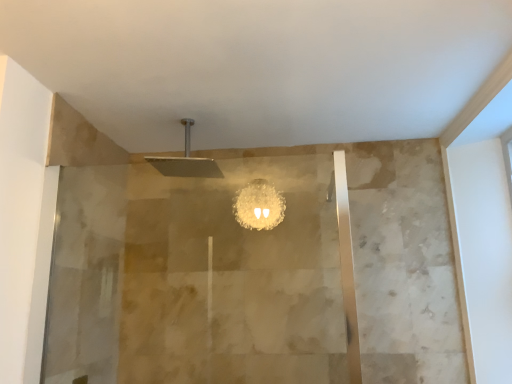
Question: Should I look upward or downward to see translucent glass screen door at left?

Choices:
 (A) down
 (B) up

Answer: (A)

Question: Can you confirm if translucent glass screen door at left is smaller than matte silver shower head at upper center?

Choices:
 (A) no
 (B) yes

Answer: (A)

Question: Is translucent glass screen door at left closer to camera compared to matte silver shower head at upper center?

Choices:
 (A) no
 (B) yes

Answer: (B)

Question: Is translucent glass screen door at left directly adjacent to matte silver shower head at upper center?

Choices:
 (A) no
 (B) yes

Answer: (A)

Question: Does translucent glass screen door at left turn towards matte silver shower head at upper center?

Choices:
 (A) no
 (B) yes

Answer: (B)

Question: Is translucent glass screen door at left behind matte silver shower head at upper center?

Choices:
 (A) no
 (B) yes

Answer: (A)

Question: From the image's perspective, does translucent glass screen door at left appear lower than matte silver shower head at upper center?

Choices:
 (A) yes
 (B) no

Answer: (A)

Question: Considering the relative sizes of matte silver shower head at upper center and translucent glass screen door at left in the image provided, is matte silver shower head at upper center shorter than translucent glass screen door at left?

Choices:
 (A) yes
 (B) no

Answer: (A)

Question: Is matte silver shower head at upper center aimed at translucent glass screen door at left?

Choices:
 (A) no
 (B) yes

Answer: (A)

Question: Considering the relative sizes of matte silver shower head at upper center and translucent glass screen door at left in the image provided, is matte silver shower head at upper center taller than translucent glass screen door at left?

Choices:
 (A) no
 (B) yes

Answer: (A)

Question: Are matte silver shower head at upper center and translucent glass screen door at left far apart?

Choices:
 (A) yes
 (B) no

Answer: (B)

Question: From the image's perspective, would you say matte silver shower head at upper center is shown under translucent glass screen door at left?

Choices:
 (A) yes
 (B) no

Answer: (B)

Question: Can you confirm if matte silver shower head at upper center is smaller than translucent glass screen door at left?

Choices:
 (A) no
 (B) yes

Answer: (B)

Question: In terms of width, does translucent glass screen door at left look wider or thinner when compared to matte silver shower head at upper center?

Choices:
 (A) wide
 (B) thin

Answer: (B)